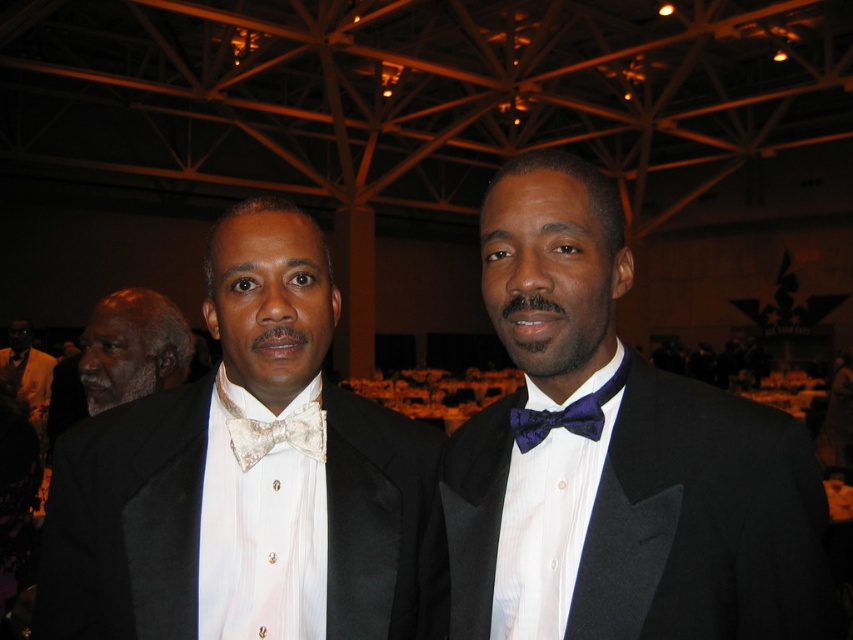
You are a photographer at a formal event. You need to adjust your camera to focus on the gray matte bow tie at upper left and the matte black suit at left. Which object should you focus on first if you want to capture both in sharp detail?

The gray matte bow tie at upper left is bigger than the matte black suit at left, so you should focus on the gray matte bow tie at upper left first to ensure it is in sharp detail before adjusting for the smaller matte black suit at left.

You are a photographer at a formal event. You need to capture a closeup of the gray matte bow tie at upper left and the matte black suit at left. Which object should you focus on first to ensure it appears sharp in the photo?

The gray matte bow tie at upper left is closer to the viewer than the matte black suit at left, so you should focus on the gray matte bow tie at upper left first to ensure it appears sharp in the photo.

You are a photographer at a formal event. You need to take a photo of both the pearl white satin bow tie at center and the matte black suit at left. Since you can only focus on one subject at a time, which one should you focus on to ensure the other is still in the frame?

You should focus on the pearl white satin bow tie at center because it is positioned to the right of the matte black suit at left, so keeping it in focus will naturally include the matte black suit at left in the frame as well.